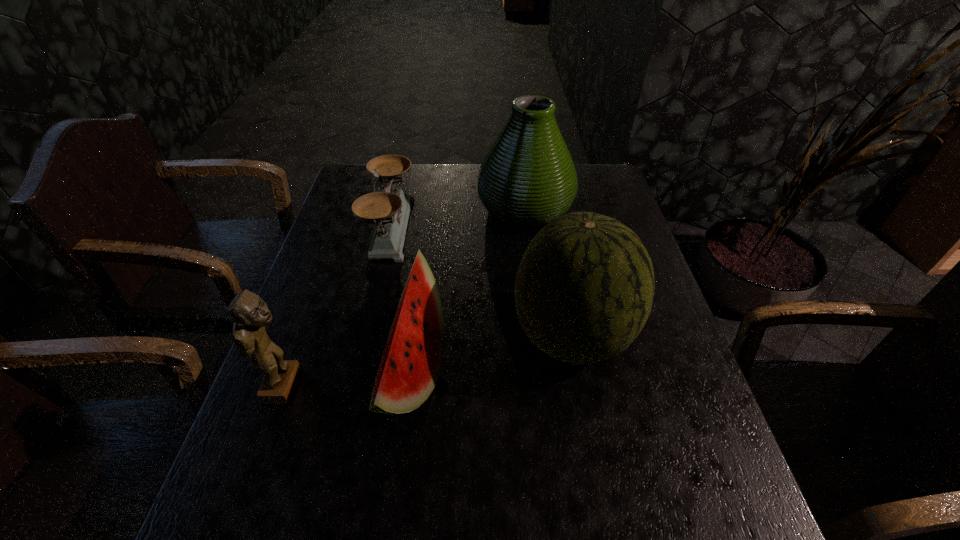
Where is `vacant region located 0.400m on the outer rind of the left watermelon`? This screenshot has width=960, height=540. vacant region located 0.400m on the outer rind of the left watermelon is located at coordinates (625, 370).

The image size is (960, 540). I want to click on vase located at the far edge, so click(527, 179).

You are a GUI agent. You are given a task and a screenshot of the screen. Output one action in this format:
    pyautogui.click(x=<x>, y=<y>)
    Task: Click on the scale at the far edge
    The width and height of the screenshot is (960, 540).
    Given the screenshot: What is the action you would take?
    pyautogui.click(x=389, y=210)

This screenshot has height=540, width=960. In order to click on figurine located at the left edge in this screenshot , I will do `click(251, 315)`.

You are a GUI agent. You are given a task and a screenshot of the screen. Output one action in this format:
    pyautogui.click(x=<x>, y=<y>)
    Task: Click on the scale that is positioned at the left edge
    The height and width of the screenshot is (540, 960).
    Given the screenshot: What is the action you would take?
    pyautogui.click(x=389, y=210)

At what (x,y) coordinates should I click in order to perform the action: click on vase that is at the right edge. Please return your answer as a coordinate pair (x, y). This screenshot has width=960, height=540. Looking at the image, I should click on (527, 179).

This screenshot has height=540, width=960. Identify the location of watermelon positioned at the right edge. (584, 289).

You are a GUI agent. You are given a task and a screenshot of the screen. Output one action in this format:
    pyautogui.click(x=<x>, y=<y>)
    Task: Click on the object that is at the far left corner
    The image size is (960, 540).
    Given the screenshot: What is the action you would take?
    pyautogui.click(x=389, y=210)

The height and width of the screenshot is (540, 960). Identify the location of object located in the far right corner section of the desktop. (527, 179).

Where is `vacant space at the left edge`? vacant space at the left edge is located at coordinates (354, 245).